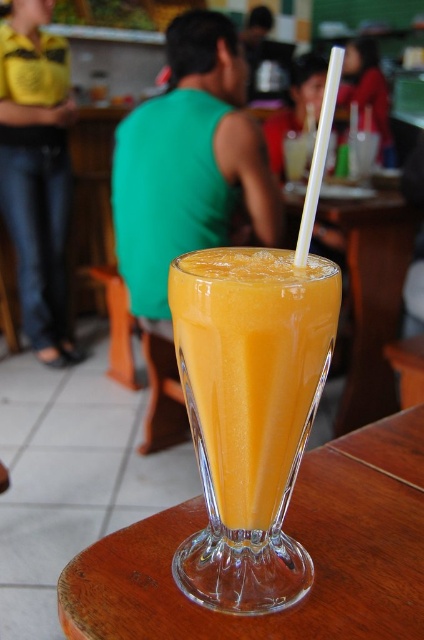
You are a delivery person who needs to place a small package on the table without blocking the white plastic straw at upper center. Can you fit the package on the transparent wood table at center if the package is 10 cm wide?

The transparent wood table at center might be wider than the white plastic straw at upper center, but since the package is only 10 cm wide, there should be enough space to place it on the table without blocking the straw.

You are a customer at the cafe and want to place your matte black phone at upper right on the transparent wood table at center. Can you do that without moving anything else?

The transparent wood table at center is positioned on the left side of matte black phone at upper right, so the phone is already placed on the table. Therefore, you don